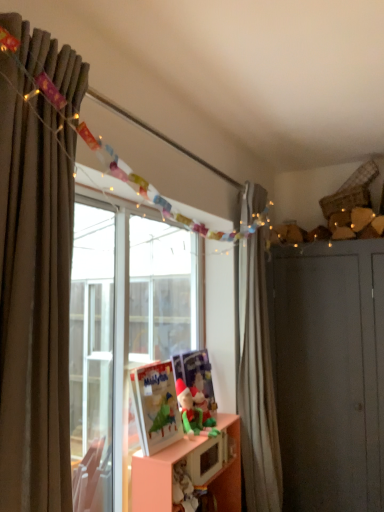
What do you see at coordinates (257, 382) in the screenshot? Image resolution: width=384 pixels, height=512 pixels. I see `white matte curtain at right, arranged as the second curtain when viewed from the front` at bounding box center [257, 382].

Measure the distance between point (150, 388) and camera.

They are 1.75 meters apart.

What are the coordinates of `green felt santa at center, which is counted as the 2th toy, starting from the back` in the screenshot? It's located at (194, 410).

What is the approximate width of green plush toy at lower center, which appears as the first toy when viewed from the back?

The width of green plush toy at lower center, which appears as the first toy when viewed from the back, is 5.16 inches.

Locate an element on the screen. orange matte cabinet at center is located at coordinates (190, 471).

Which object is further away from the camera taking this photo, matte plastic picture frame at center or matte gray dresser at right?

matte gray dresser at right is further from the camera.

In terms of size, does matte plastic picture frame at center appear bigger or smaller than matte gray dresser at right?

Clearly, matte plastic picture frame at center is smaller in size than matte gray dresser at right.

Is matte plastic picture frame at center thinner than matte gray dresser at right?

Yes, matte plastic picture frame at center is thinner than matte gray dresser at right.

You are a GUI agent. You are given a task and a screenshot of the screen. Output one action in this format:
    pyautogui.click(x=<x>, y=<y>)
    Task: Click on the dresser located below the matte plastic picture frame at center (from the image's perspective)
    The image size is (384, 512).
    Given the screenshot: What is the action you would take?
    pyautogui.click(x=329, y=372)

Looking at this image, is brown fabric curtain at left, placed as the first curtain when sorted from front to back, closer to the viewer compared to green plush toy at lower center, which is counted as the 2th toy, starting from the front?

Yes.

From the image's perspective, is brown fabric curtain at left, which is the second curtain in back-to-front order, under green plush toy at lower center, which appears as the first toy when viewed from the back?

No, from the image's perspective, brown fabric curtain at left, which is the second curtain in back-to-front order, is not below green plush toy at lower center, which appears as the first toy when viewed from the back.

Considering the positions of objects green plush toy at lower center, which is counted as the 2th toy, starting from the front, and orange matte cabinet at center in the image provided, who is more to the right, green plush toy at lower center, which is counted as the 2th toy, starting from the front, or orange matte cabinet at center?

orange matte cabinet at center is more to the right.

From a real-world perspective, does green plush toy at lower center, which is counted as the 2th toy, starting from the front, sit lower than orange matte cabinet at center?

Incorrect, from a real-world perspective, green plush toy at lower center, which is counted as the 2th toy, starting from the front, is higher than orange matte cabinet at center.

Is green plush toy at lower center, which appears as the first toy when viewed from the back, taller or shorter than orange matte cabinet at center?

green plush toy at lower center, which appears as the first toy when viewed from the back, is shorter than orange matte cabinet at center.

Find the location of a particular element. The image size is (384, 512). cabinetry in front of the green plush toy at lower center, which appears as the first toy when viewed from the back is located at coordinates (190, 471).

Does matte gray dresser at right come behind white matte curtain at right, the first curtain positioned from the back?

That is True.

From a real-world perspective, who is located higher, matte gray dresser at right or white matte curtain at right, acting as the 2th curtain starting from the left?

In real-world perspective, white matte curtain at right, acting as the 2th curtain starting from the left, is above.

From the image's perspective, is matte gray dresser at right located above or below white matte curtain at right, the first curtain when ordered from right to left?

Clearly, from the image's perspective, matte gray dresser at right is below white matte curtain at right, the first curtain when ordered from right to left.

Is matte gray dresser at right at the right side of white matte curtain at right, acting as the 2th curtain starting from the left?

Yes, matte gray dresser at right is to the right of white matte curtain at right, acting as the 2th curtain starting from the left.

From the image's perspective, relative to matte plastic picture frame at center, is green plush toy at lower center, which appears as the first toy when viewed from the back, above or below?

Clearly, from the image's perspective, green plush toy at lower center, which appears as the first toy when viewed from the back, is below matte plastic picture frame at center.

Is green plush toy at lower center, which is counted as the 2th toy, starting from the front, not near matte plastic picture frame at center?

Actually, green plush toy at lower center, which is counted as the 2th toy, starting from the front, and matte plastic picture frame at center are a little close together.

Is green plush toy at lower center, which is counted as the 2th toy, starting from the front, in front of or behind matte plastic picture frame at center in the image?

green plush toy at lower center, which is counted as the 2th toy, starting from the front, is behind matte plastic picture frame at center.

Is white matte curtain at right, the first curtain positioned from the back, oriented towards green felt santa at center, arranged as the first toy when viewed from the front?

No, white matte curtain at right, the first curtain positioned from the back, does not turn towards green felt santa at center, arranged as the first toy when viewed from the front.

Is white matte curtain at right, the first curtain positioned from the back, positioned behind green felt santa at center, arranged as the first toy when viewed from the front?

Yes, the depth of white matte curtain at right, the first curtain positioned from the back, is greater than that of green felt santa at center, arranged as the first toy when viewed from the front.

Can you confirm if white matte curtain at right, the first curtain when ordered from right to left, is bigger than green felt santa at center, which is counted as the 2th toy, starting from the back?

Indeed, white matte curtain at right, the first curtain when ordered from right to left, has a larger size compared to green felt santa at center, which is counted as the 2th toy, starting from the back.

Is white matte curtain at right, acting as the 2th curtain starting from the left, positioned beyond the bounds of green felt santa at center, which is counted as the 2th toy, starting from the back?

Yes, white matte curtain at right, acting as the 2th curtain starting from the left, is outside of green felt santa at center, which is counted as the 2th toy, starting from the back.

Are matte plastic picture frame at center and green felt santa at center, arranged as the first toy when viewed from the front, located far from each other?

No, matte plastic picture frame at center is not far from green felt santa at center, arranged as the first toy when viewed from the front.

Considering the sizes of objects matte plastic picture frame at center and green felt santa at center, which is counted as the 2th toy, starting from the back, in the image provided, who is wider, matte plastic picture frame at center or green felt santa at center, which is counted as the 2th toy, starting from the back,?

With larger width is green felt santa at center, which is counted as the 2th toy, starting from the back.

Considering the relative sizes of matte plastic picture frame at center and green felt santa at center, arranged as the first toy when viewed from the front, in the image provided, is matte plastic picture frame at center bigger than green felt santa at center, arranged as the first toy when viewed from the front,?

Yes, matte plastic picture frame at center is bigger than green felt santa at center, arranged as the first toy when viewed from the front.

From the image's perspective, which one is positioned lower, matte plastic picture frame at center or green felt santa at center, arranged as the first toy when viewed from the front?

green felt santa at center, arranged as the first toy when viewed from the front, from the image's perspective.

Identify the location of picture frame above the matte gray dresser at right (from a real-world perspective). (156, 406).

Locate an element on the screen. the 2nd toy behind the brown fabric curtain at left, which is the second curtain in back-to-front order is located at coordinates (203, 400).

Considering their positions, is white matte curtain at right, acting as the 2th curtain starting from the left, positioned closer to brown fabric curtain at left, which ranks as the first curtain in left-to-right order, than matte plastic picture frame at center?

Among the two, matte plastic picture frame at center is located nearer to brown fabric curtain at left, which ranks as the first curtain in left-to-right order.

Considering their positions, is brown fabric curtain at left, which ranks as the first curtain in left-to-right order, positioned closer to white matte curtain at right, arranged as the second curtain when viewed from the front, than green plush toy at lower center, which is counted as the 2th toy, starting from the front?

green plush toy at lower center, which is counted as the 2th toy, starting from the front.

Looking at the image, which one is located further to orange matte cabinet at center, white matte curtain at right, the first curtain when ordered from right to left, or green plush toy at lower center, which is counted as the 2th toy, starting from the front?

The object further to orange matte cabinet at center is white matte curtain at right, the first curtain when ordered from right to left.

When comparing their distances from matte gray dresser at right, does green felt santa at center, arranged as the first toy when viewed from the front, or white matte curtain at right, arranged as the second curtain when viewed from the front, seem closer?

white matte curtain at right, arranged as the second curtain when viewed from the front, lies closer to matte gray dresser at right than the other object.

Considering their positions, is green felt santa at center, arranged as the first toy when viewed from the front, positioned further to white matte curtain at right, acting as the 2th curtain starting from the left, than brown fabric curtain at left, which is the 2th curtain in right-to-left order?

brown fabric curtain at left, which is the 2th curtain in right-to-left order, is further to white matte curtain at right, acting as the 2th curtain starting from the left.

When comparing their distances from orange matte cabinet at center, does brown fabric curtain at left, which is the second curtain in back-to-front order, or green felt santa at center, arranged as the first toy when viewed from the front, seem further?

brown fabric curtain at left, which is the second curtain in back-to-front order, is further to orange matte cabinet at center.

Which object lies nearer to the anchor point green felt santa at center, which is counted as the 2th toy, starting from the back, orange matte cabinet at center or white matte curtain at right, acting as the 2th curtain starting from the left?

Based on the image, orange matte cabinet at center appears to be nearer to green felt santa at center, which is counted as the 2th toy, starting from the back.

Looking at the image, which one is located closer to brown fabric curtain at left, which is the second curtain in back-to-front order, green plush toy at lower center, which is counted as the 2th toy, starting from the front, or green felt santa at center, arranged as the first toy when viewed from the front?

green felt santa at center, arranged as the first toy when viewed from the front, is closer to brown fabric curtain at left, which is the second curtain in back-to-front order.

Image resolution: width=384 pixels, height=512 pixels. I want to click on toy between brown fabric curtain at left, which ranks as the first curtain in left-to-right order, and green plush toy at lower center, which appears as the first toy when viewed from the back, from front to back, so click(x=194, y=410).

Locate an element on the screen. The width and height of the screenshot is (384, 512). cabinetry between brown fabric curtain at left, which is the second curtain in back-to-front order, and green plush toy at lower center, which is counted as the 2th toy, starting from the front, along the z-axis is located at coordinates (190, 471).

Where is `picture frame located between brown fabric curtain at left, which is the 2th curtain in right-to-left order, and green felt santa at center, arranged as the first toy when viewed from the front, in the depth direction`? The width and height of the screenshot is (384, 512). picture frame located between brown fabric curtain at left, which is the 2th curtain in right-to-left order, and green felt santa at center, arranged as the first toy when viewed from the front, in the depth direction is located at coordinates (156, 406).

Where is `curtain between brown fabric curtain at left, which is the second curtain in back-to-front order, and matte gray dresser at right from front to back`? curtain between brown fabric curtain at left, which is the second curtain in back-to-front order, and matte gray dresser at right from front to back is located at coordinates (257, 382).